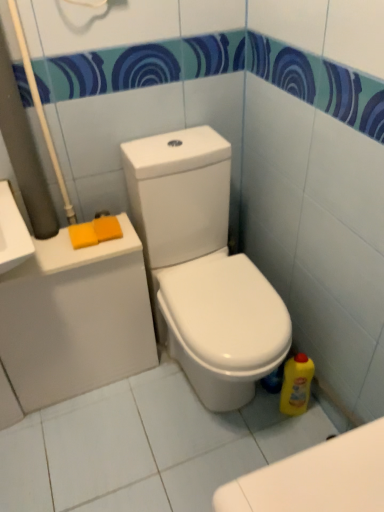
Locate an element on the screen. The height and width of the screenshot is (512, 384). white glossy toilet at center is located at coordinates (202, 267).

This screenshot has width=384, height=512. In order to click on yellow plastic bottle at lower right in this screenshot , I will do `click(296, 385)`.

Would you say white glossy toilet at center is outside yellow plastic bottle at lower right?

Yes, white glossy toilet at center is not within yellow plastic bottle at lower right.

Measure the distance from white glossy toilet at center to yellow plastic bottle at lower right.

A distance of 17.25 inches exists between white glossy toilet at center and yellow plastic bottle at lower right.

Consider the image. What's the angular difference between white glossy toilet at center and yellow plastic bottle at lower right's facing directions?

The angular difference between white glossy toilet at center and yellow plastic bottle at lower right is 0.000237 degrees.

Is white glossy toilet at center further to camera compared to yellow plastic bottle at lower right?

That is False.

Is point (94, 241) positioned behind point (192, 336)?

That is True.

Is orange sponge at left, the 2th soap positioned from the right, looking in the opposite direction of white glossy toilet at center?

No, orange sponge at left, the 2th soap positioned from the right,'s orientation is not away from white glossy toilet at center.

Can you confirm if orange sponge at left, the first soap in the left-to-right sequence, is smaller than white glossy toilet at center?

Indeed, orange sponge at left, the first soap in the left-to-right sequence, has a smaller size compared to white glossy toilet at center.

Which object is wider, orange sponge at left, the 2th soap positioned from the right, or white glossy toilet at center?

With larger width is white glossy toilet at center.

Considering the sizes of objects yellow plastic bottle at lower right and orange sponge at upper left, which is the 1th soap from right to left, in the image provided, who is taller, yellow plastic bottle at lower right or orange sponge at upper left, which is the 1th soap from right to left,?

yellow plastic bottle at lower right is taller.

Looking at this image, which is behind, yellow plastic bottle at lower right or orange sponge at upper left, which is the 1th soap from right to left?

yellow plastic bottle at lower right is further from the camera.

Consider the image. Do you think yellow plastic bottle at lower right is within orange sponge at upper left, which is the second soap in left-to-right order, or outside of it?

yellow plastic bottle at lower right is located beyond the bounds of orange sponge at upper left, which is the second soap in left-to-right order.

Can you tell me how much yellow plastic bottle at lower right and orange sponge at upper left, which is the 1th soap from right to left, differ in facing direction?

They differ by 1.51 degrees in their facing directions.

From a real-world perspective, between white glossy toilet at center and orange sponge at upper left, which is the second soap in left-to-right order, who is vertically lower?

In real-world perspective, white glossy toilet at center is lower.

Is white glossy toilet at center far from orange sponge at upper left, which is the 1th soap from right to left?

No, white glossy toilet at center is in close proximity to orange sponge at upper left, which is the 1th soap from right to left.

Considering the positions of objects white glossy toilet at center and orange sponge at upper left, which is the 1th soap from right to left, in the image provided, who is in front, white glossy toilet at center or orange sponge at upper left, which is the 1th soap from right to left,?

white glossy toilet at center is in front.

Is white glossy toilet at center aimed at orange sponge at upper left, which is the second soap in left-to-right order?

No, white glossy toilet at center is not turned towards orange sponge at upper left, which is the second soap in left-to-right order.

Which object is more forward, orange sponge at left, the 2th soap positioned from the right, or orange sponge at upper left, which is the second soap in left-to-right order?

Result: orange sponge at left, the 2th soap positioned from the right.

Based on the photo, who is bigger, orange sponge at left, the first soap in the left-to-right sequence, or orange sponge at upper left, which is the 1th soap from right to left?

orange sponge at upper left, which is the 1th soap from right to left.

At what (x,y) coordinates should I click in order to perform the action: click on soap on the left of the orange sponge at upper left, which is the second soap in left-to-right order. Please return your answer as a coordinate pair (x, y). This screenshot has height=512, width=384. Looking at the image, I should click on (82, 234).

Between point (113, 218) and point (84, 231), which one is positioned in front?

The point (84, 231) is more forward.

How much distance is there between orange sponge at upper left, which is the 1th soap from right to left, and orange sponge at left, the 2th soap positioned from the right?

They are 1.69 inches apart.

From a real-world perspective, which is physically below, orange sponge at upper left, which is the 1th soap from right to left, or orange sponge at left, the first soap in the left-to-right sequence?

In real-world perspective, orange sponge at left, the first soap in the left-to-right sequence, is lower.

Is orange sponge at upper left, which is the 1th soap from right to left, not within orange sponge at left, the first soap in the left-to-right sequence?

Yes.

Locate an element on the screen. cleaning product behind the orange sponge at left, the 2th soap positioned from the right is located at coordinates (296, 385).

Between orange sponge at left, the 2th soap positioned from the right, and yellow plastic bottle at lower right, which one has larger size?

yellow plastic bottle at lower right.

From the image's perspective, would you say orange sponge at left, the first soap in the left-to-right sequence, is shown under yellow plastic bottle at lower right?

No.

Image resolution: width=384 pixels, height=512 pixels. In the image, there is a white glossy toilet at center. What are the coordinates of `cleaning product below it (from a real-world perspective)` in the screenshot? It's located at (296, 385).

In order to click on the 1st soap above the white glossy toilet at center (from the image's perspective) in this screenshot , I will do `click(82, 234)`.

Based on their spatial positions, is yellow plastic bottle at lower right or orange sponge at upper left, which is the 1th soap from right to left, closer to white glossy toilet at center?

orange sponge at upper left, which is the 1th soap from right to left, is positioned closer to the anchor white glossy toilet at center.

Estimate the real-world distances between objects in this image. Which object is closer to orange sponge at upper left, which is the 1th soap from right to left, white glossy toilet at center or orange sponge at left, the first soap in the left-to-right sequence?

orange sponge at left, the first soap in the left-to-right sequence.

Considering their positions, is yellow plastic bottle at lower right positioned further to orange sponge at upper left, which is the 1th soap from right to left, than orange sponge at left, the 2th soap positioned from the right?

The object further to orange sponge at upper left, which is the 1th soap from right to left, is yellow plastic bottle at lower right.

Estimate the real-world distances between objects in this image. Which object is further from yellow plastic bottle at lower right, orange sponge at left, the 2th soap positioned from the right, or white glossy toilet at center?

orange sponge at left, the 2th soap positioned from the right, is further to yellow plastic bottle at lower right.

From the picture: Looking at the image, which one is located closer to yellow plastic bottle at lower right, white glossy toilet at center or orange sponge at left, the first soap in the left-to-right sequence?

Among the two, white glossy toilet at center is located nearer to yellow plastic bottle at lower right.

From the image, which object appears to be farther from orange sponge at left, the first soap in the left-to-right sequence, white glossy toilet at center or orange sponge at upper left, which is the second soap in left-to-right order?

Based on the image, white glossy toilet at center appears to be further to orange sponge at left, the first soap in the left-to-right sequence.

Based on their spatial positions, is orange sponge at upper left, which is the second soap in left-to-right order, or white glossy toilet at center closer to orange sponge at left, the first soap in the left-to-right sequence?

orange sponge at upper left, which is the second soap in left-to-right order, lies closer to orange sponge at left, the first soap in the left-to-right sequence, than the other object.

Which object lies further to the anchor point orange sponge at left, the 2th soap positioned from the right, yellow plastic bottle at lower right or orange sponge at upper left, which is the 1th soap from right to left?

Among the two, yellow plastic bottle at lower right is located further to orange sponge at left, the 2th soap positioned from the right.

You are a GUI agent. You are given a task and a screenshot of the screen. Output one action in this format:
    pyautogui.click(x=<x>, y=<y>)
    Task: Click on the soap between white glossy toilet at center and orange sponge at upper left, which is the second soap in left-to-right order, in the front-back direction
    The height and width of the screenshot is (512, 384).
    Given the screenshot: What is the action you would take?
    pyautogui.click(x=82, y=234)

Find the location of `soap between orange sponge at left, the first soap in the left-to-right sequence, and yellow plastic bottle at lower right, in the horizontal direction`. soap between orange sponge at left, the first soap in the left-to-right sequence, and yellow plastic bottle at lower right, in the horizontal direction is located at coordinates (107, 228).

Find the location of a particular element. toilet between orange sponge at left, the 2th soap positioned from the right, and yellow plastic bottle at lower right, in the horizontal direction is located at coordinates (202, 267).

Identify the location of toilet situated between orange sponge at upper left, which is the second soap in left-to-right order, and yellow plastic bottle at lower right from left to right. The height and width of the screenshot is (512, 384). (202, 267).